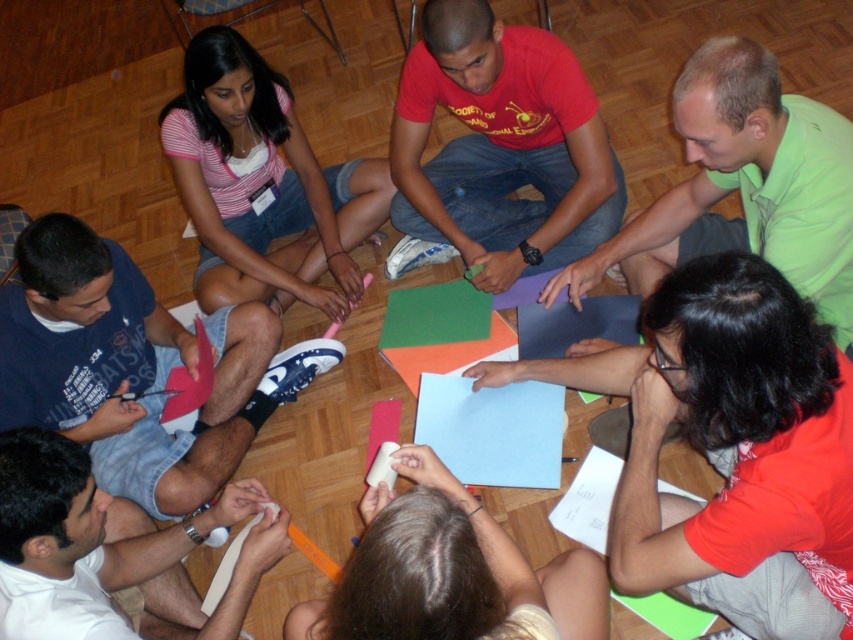
Question: Can you confirm if pink matte pen at upper left is positioned below smooth white paper at lower center?

Choices:
 (A) no
 (B) yes

Answer: (A)

Question: Can you confirm if pink matte pen at upper left is positioned to the right of white matte fabric at lower left?

Choices:
 (A) no
 (B) yes

Answer: (B)

Question: Estimate the real-world distances between objects in this image. Which object is closer to the green matte shirt at upper right?

Choices:
 (A) matte red t-shirt at center
 (B) blue cotton t-shirt at lower left

Answer: (A)

Question: Can you confirm if pink matte pen at upper left is positioned above smooth white paper at lower center?

Choices:
 (A) yes
 (B) no

Answer: (A)

Question: Which point appears farthest from the camera in this image?

Choices:
 (A) (531, 160)
 (B) (125, 552)
 (C) (67, 348)

Answer: (A)

Question: Among these points, which one is farthest from the camera?

Choices:
 (A) (554, 285)
 (B) (621, 211)
 (C) (148, 576)
 (D) (358, 632)

Answer: (B)